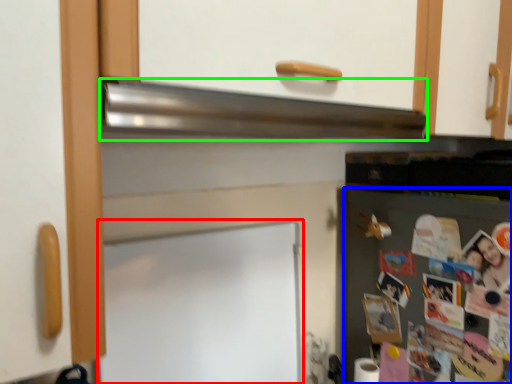
Question: Which object is positioned closest to bulletin board (highlighted by a red box)? Select from fridge (highlighted by a blue box) and exhaust hood (highlighted by a green box).

Choices:
 (A) fridge
 (B) exhaust hood

Answer: (B)